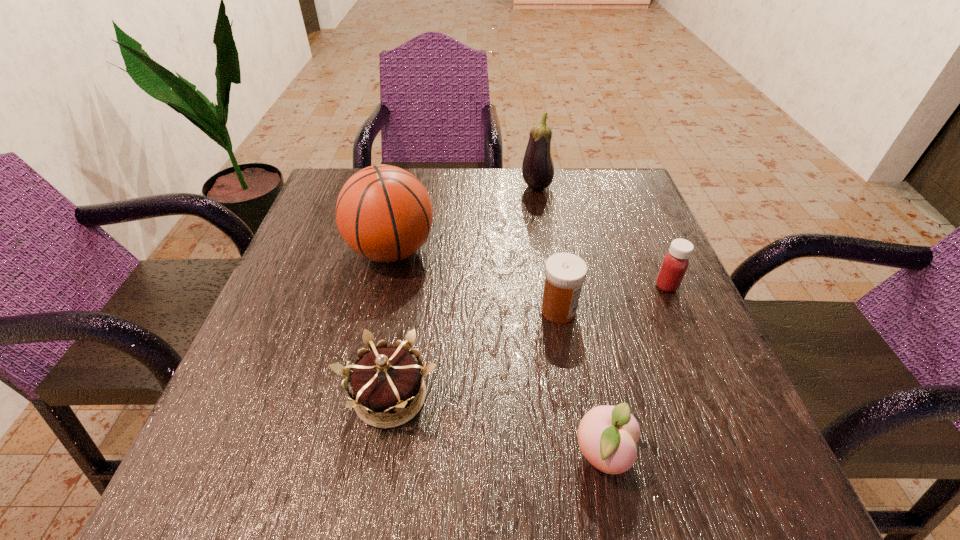
You are a GUI agent. You are given a task and a screenshot of the screen. Output one action in this format:
    pyautogui.click(x=<x>, y=<y>)
    Task: Click on the free space between the rightmost object and the peach
    Image resolution: width=960 pixels, height=540 pixels.
    Given the screenshot: What is the action you would take?
    pyautogui.click(x=635, y=370)

Locate an element on the screen. The height and width of the screenshot is (540, 960). empty space that is in between the farthest object and the crown is located at coordinates (464, 292).

The image size is (960, 540). Find the location of `vacant region between the farther medicine and the crown`. vacant region between the farther medicine and the crown is located at coordinates (529, 341).

The image size is (960, 540). In order to click on free spot between the eggplant and the basketball in this screenshot , I will do `click(465, 219)`.

Locate an element on the screen. The image size is (960, 540). object that is the fifth closest to the basketball is located at coordinates (675, 263).

Locate an element on the screen. The width and height of the screenshot is (960, 540). object that is the second closest to the eggplant is located at coordinates (675, 263).

The height and width of the screenshot is (540, 960). I want to click on blank area in the image that satisfies the following two spatial constraints: 1. on the back side of the crown; 2. on the left side of the farther medicine, so click(409, 286).

This screenshot has height=540, width=960. In order to click on free space that satisfies the following two spatial constraints: 1. on the front side of the peach; 2. on the left side of the crown in this screenshot , I will do `click(381, 455)`.